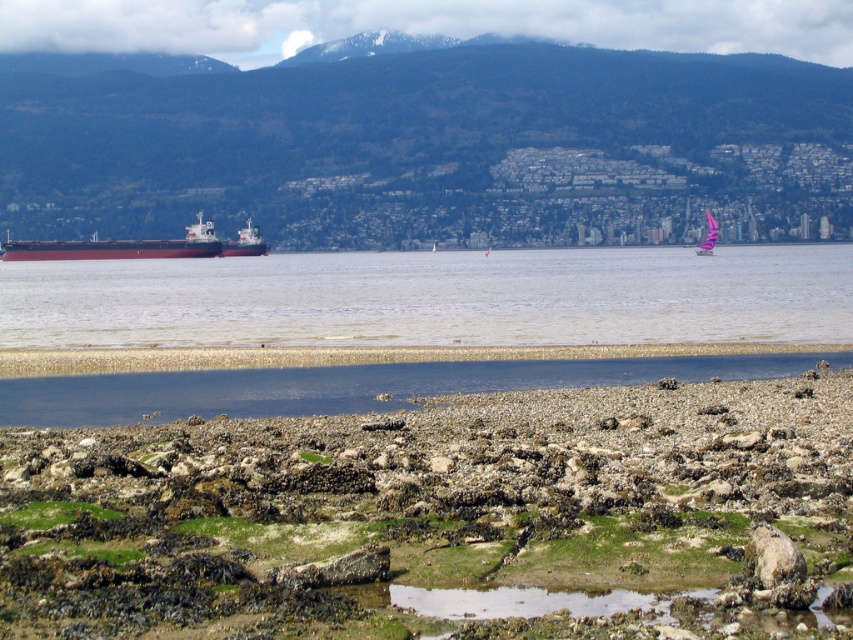
You are standing on the rocky shoreline and want to take a photo of both the red matte cargo ship at left and the pink fabric sailboat at center. Which object should you frame first in your camera to ensure both are in the shot?

You should frame the red matte cargo ship at left first since it is positioned on the left side of the pink fabric sailboat at center, ensuring both are included in the shot.

You are a hiker planning to reach the green forested mountain at upper center. There is a marked point at coordinates point (x=419, y=141) on the mountain. Can you confirm if this point is located on the green forested mountain at upper center?

Yes, the point (x=419, y=141) is located on the green forested mountain at upper center according to the description.

You are standing at the shoreline looking out towards the bay. There are two points marked on your map at coordinates point (x=758, y=339) and point (x=715, y=243). Which point is closer to you?

Point (x=758, y=339) is in front of point (x=715, y=243), so it is closer to you.